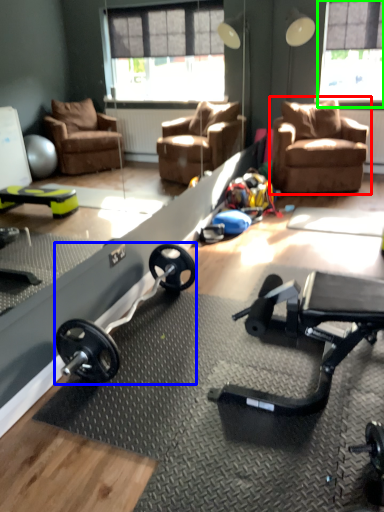
Question: Based on their relative distances, which object is farther from chair (highlighted by a red box)? Choose from barbell (highlighted by a blue box) and window screen (highlighted by a green box).

Choices:
 (A) barbell
 (B) window screen

Answer: (A)